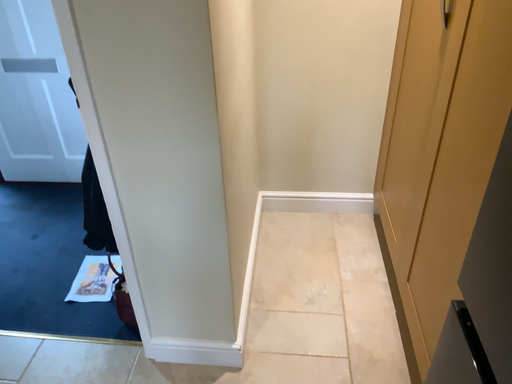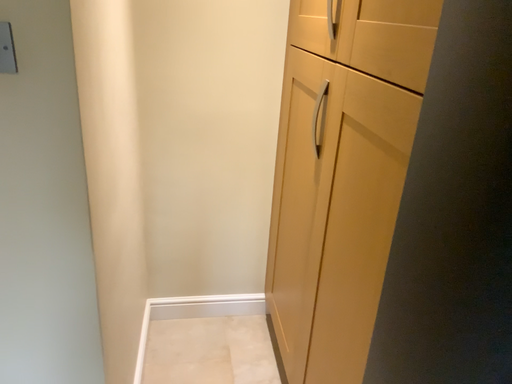
Question: How did the camera likely rotate when shooting the video?

Choices:
 (A) rotated upward
 (B) rotated downward

Answer: (A)